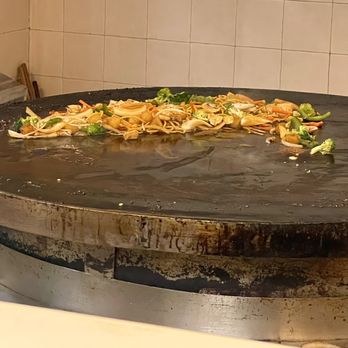
The image size is (348, 348). Identify the location of cooking skillet. (77, 187).